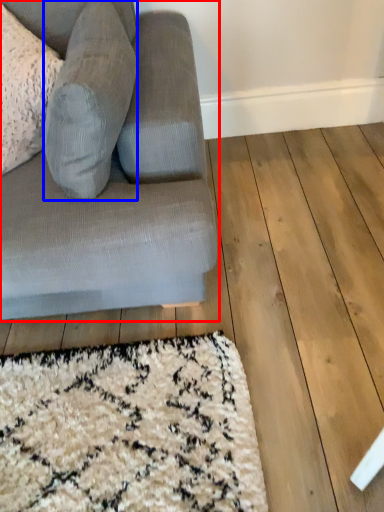
Question: Which object is closer to the camera taking this photo, studio couch (highlighted by a red box) or gray (highlighted by a blue box)?

Choices:
 (A) studio couch
 (B) gray

Answer: (A)